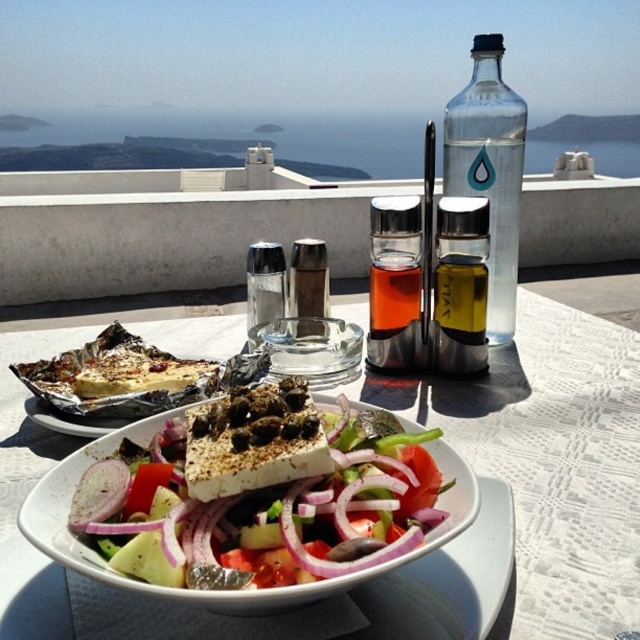
You are a chef preparing to serve a dish. You need to place the white creamy feta cheese with fresh vegetables at center and the satin silver shaker at center on a shelf. The shelf has a height limit of 10 cm. Can both items fit vertically on the shelf without exceeding the height limit?

The white creamy feta cheese with fresh vegetables at center has a lesser height compared to the satin silver shaker at center. Since the satin silver shaker at center is taller, we need to check its height. However, the exact height of the satin silver shaker at center isn not provided. Without knowing its height, we cannot confirm if it will exceed the 10 cm limit. Therefore, it is uncertain if both items can fit vertically on the shelf.

You are a chef preparing to present a dish. You have the white creamy feta cheese with fresh vegetables at center and the satin silver shaker at center on your work surface. Which of these two items requires more space to accommodate its size?

The white creamy feta cheese with fresh vegetables at center is larger in size than the satin silver shaker at center, so it requires more space to accommodate its size.